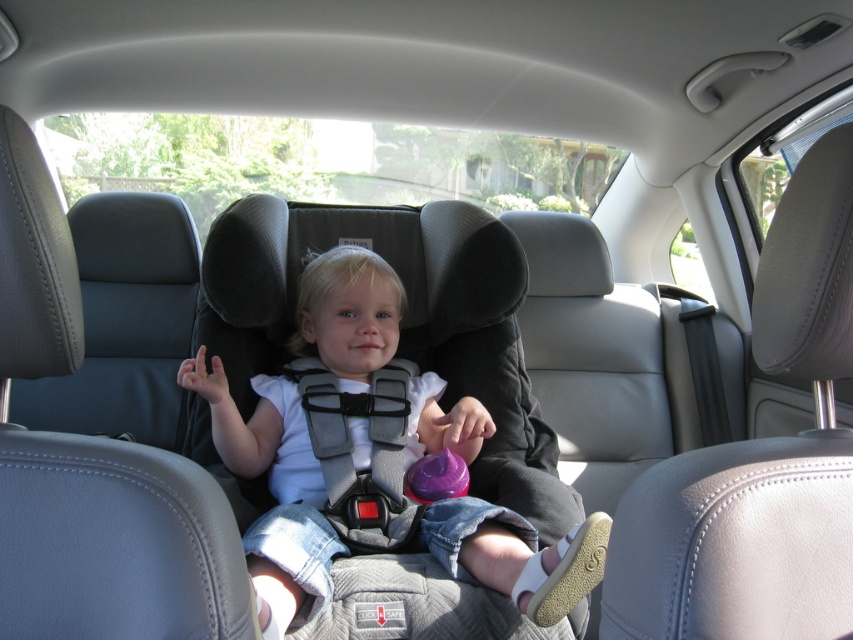
Question: Which of the following is the farthest from the observer?

Choices:
 (A) (289, 493)
 (B) (515, 586)

Answer: (A)

Question: Is matte gray car seat at center positioned before gray fabric safety vest at center?

Choices:
 (A) yes
 (B) no

Answer: (A)

Question: Is matte gray car seat at center bigger than gray fabric safety vest at center?

Choices:
 (A) no
 (B) yes

Answer: (B)

Question: Considering the relative positions of matte gray car seat at center and gray fabric safety vest at center in the image provided, where is matte gray car seat at center located with respect to gray fabric safety vest at center?

Choices:
 (A) left
 (B) right

Answer: (B)